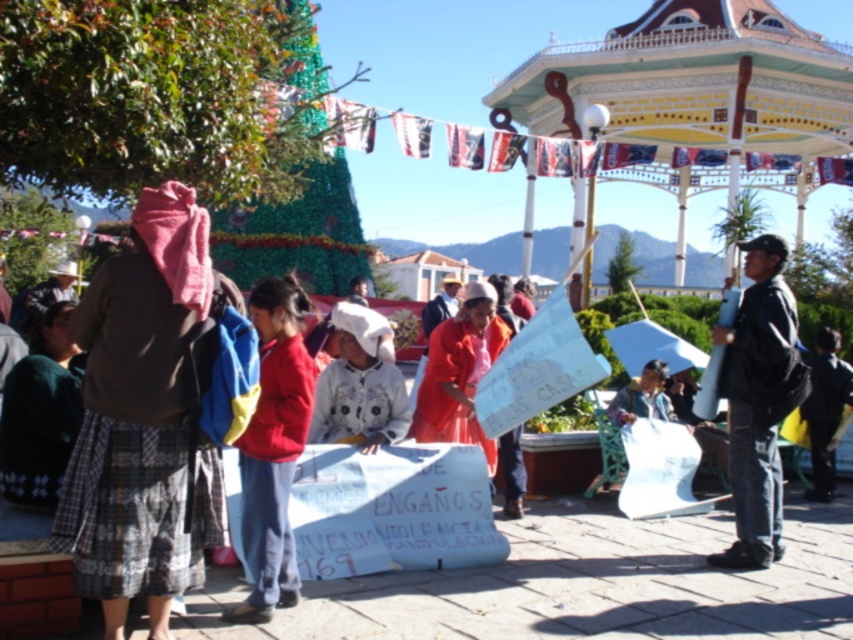
Question: Which point is closer to the camera?

Choices:
 (A) (598, 99)
 (B) (379, 339)
 (C) (770, 560)
 (D) (247, 544)

Answer: (D)

Question: Can you confirm if black leather jacket at right is positioned to the left of white fabric at center?

Choices:
 (A) no
 (B) yes

Answer: (A)

Question: Considering the real-world distances, which object is farthest from the black leather jacket at right?

Choices:
 (A) plaid fabric skirt at left
 (B) white fabric at center

Answer: (A)

Question: From the image, what is the correct spatial relationship of decorative painted wood gazebo at upper right in relation to black leather jacket at right?

Choices:
 (A) below
 (B) above

Answer: (B)

Question: Which point is farther to the camera?

Choices:
 (A) white fabric at center
 (B) dark blue jacket at center
 (C) red fabric jacket at center

Answer: (B)

Question: Observing the image, what is the correct spatial positioning of decorative painted wood gazebo at upper right in reference to white fabric at center?

Choices:
 (A) above
 (B) below

Answer: (A)